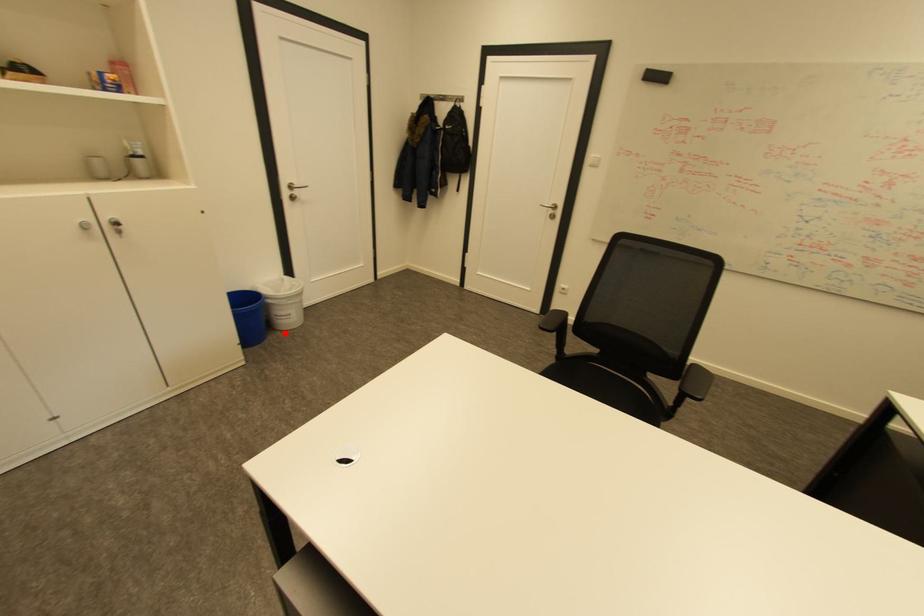
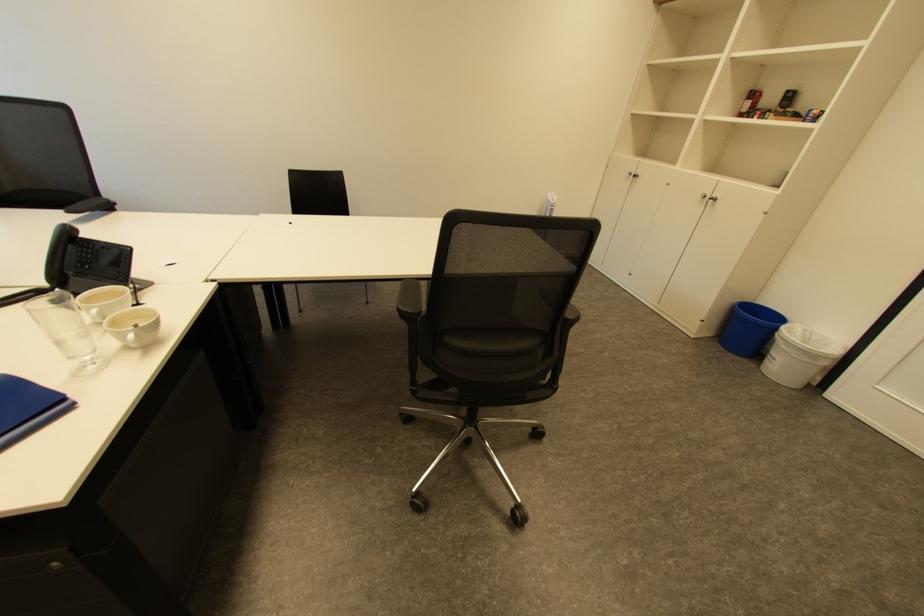
In the second image, find the point that corresponds to the highlighted location in the first image.

(760, 365)